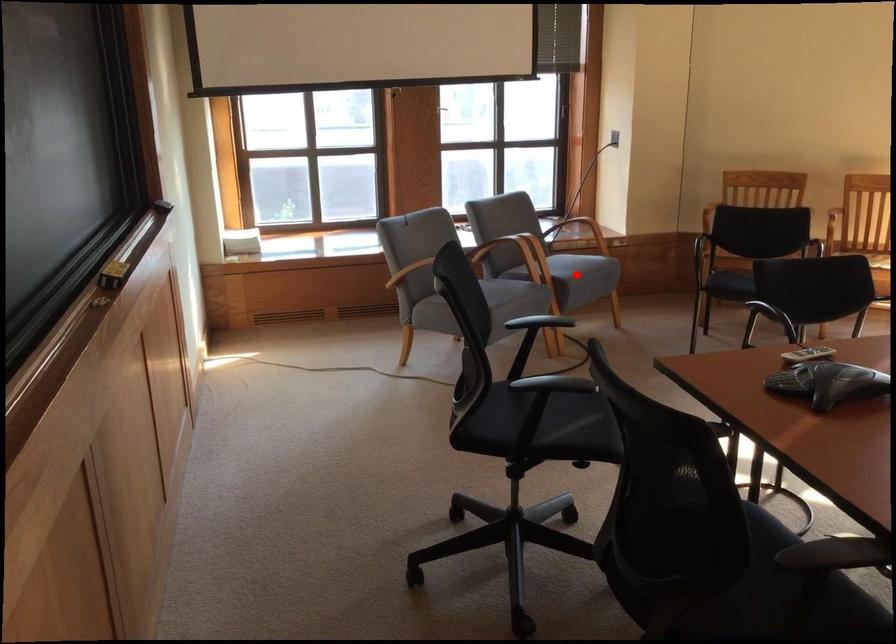
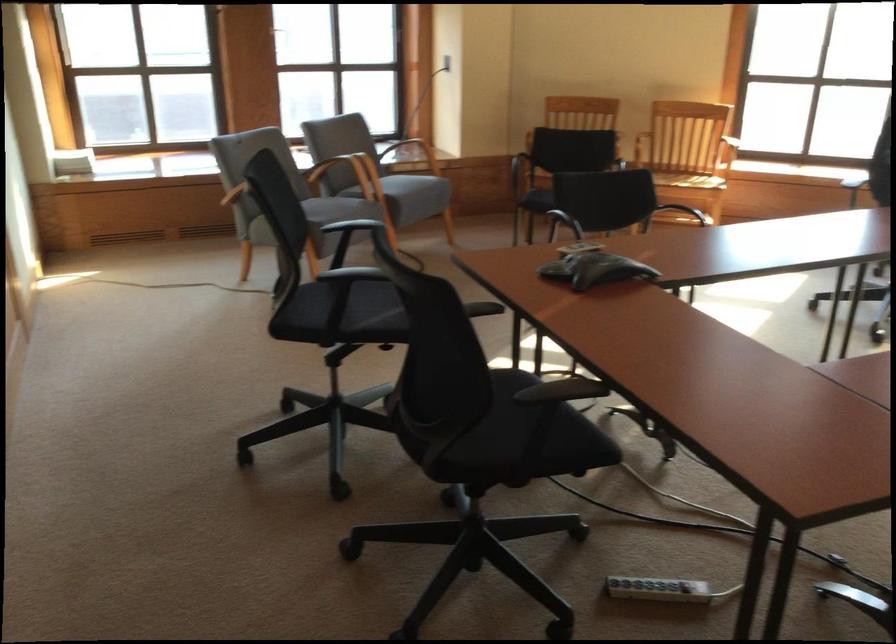
In the second image, find the point that corresponds to the highlighted location in the first image.

(410, 194)